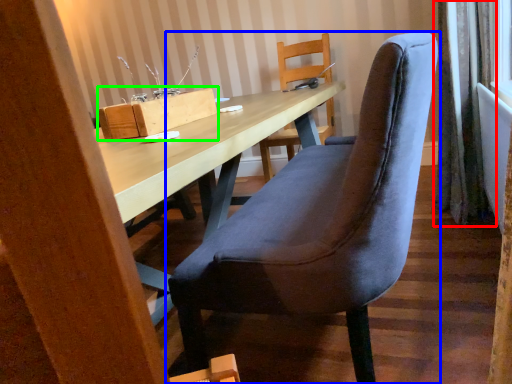
Question: Which object is the closest to the curtain (highlighted by a red box)? Choose among these: chair (highlighted by a blue box) or cardboard box (highlighted by a green box).

Choices:
 (A) chair
 (B) cardboard box

Answer: (A)